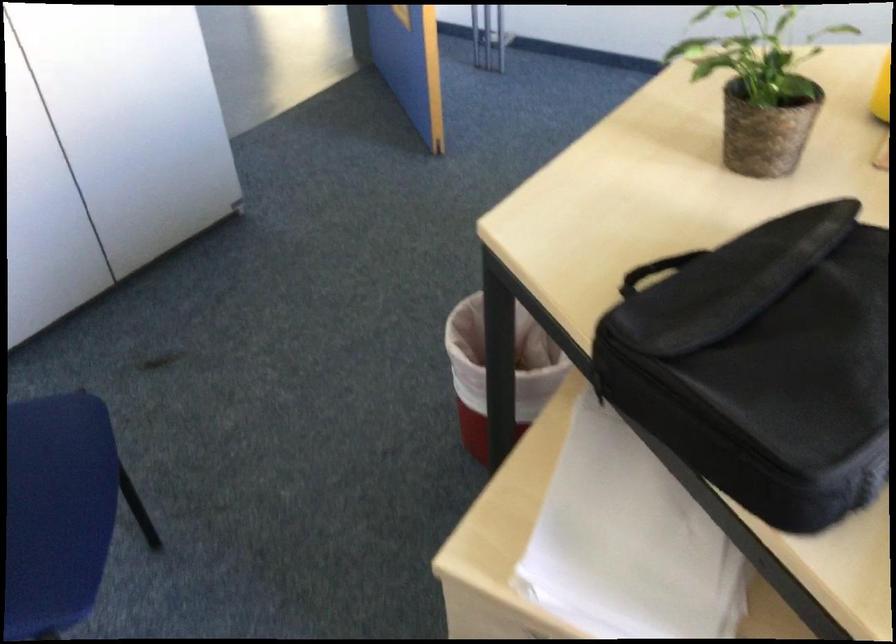
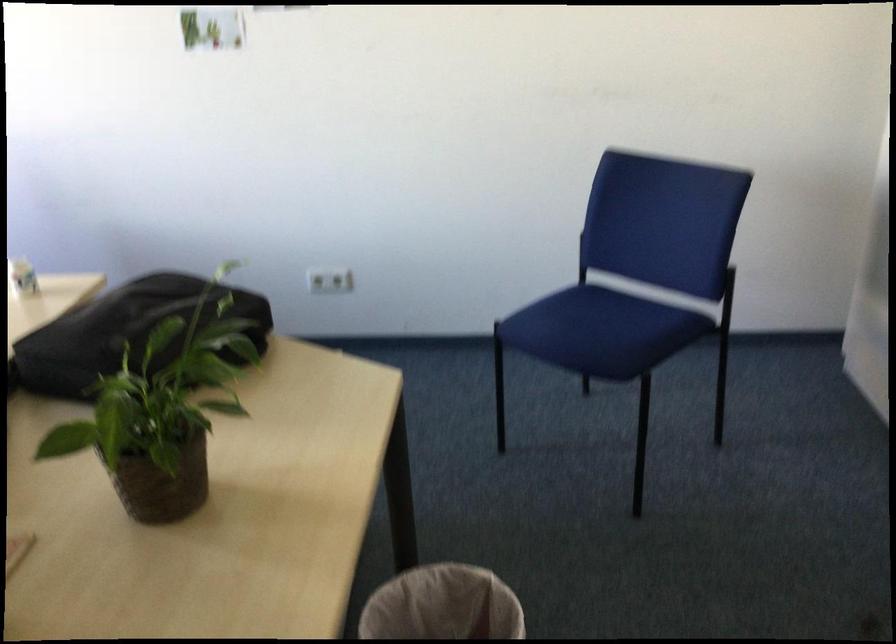
Where in the second image is the point corresponding to point 480,419 from the first image?

(442, 605)